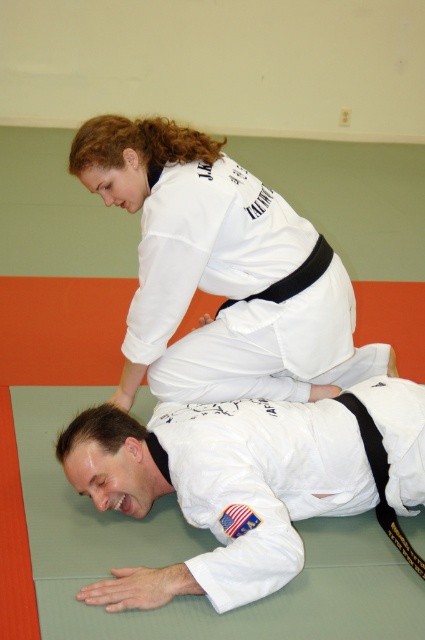
Between white matte kimono at lower center and black matte belt at center, which one appears on the left side from the viewer's perspective?

From the viewer's perspective, white matte kimono at lower center appears more on the left side.

Between point (297, 564) and point (246, 298), which one is positioned in front?

Point (297, 564) is more forward.

Between point (354, 477) and point (277, 291), which one is positioned behind?

Positioned behind is point (277, 291).

At what (x,y) coordinates should I click in order to perform the action: click on white matte kimono at lower center. Please return your answer as a coordinate pair (x, y). This screenshot has height=640, width=425. Looking at the image, I should click on (221, 488).

Is white matte kimono at upper center below white matte kimono at lower center?

No, white matte kimono at upper center is not below white matte kimono at lower center.

Image resolution: width=425 pixels, height=640 pixels. What do you see at coordinates (221, 273) in the screenshot?
I see `white matte kimono at upper center` at bounding box center [221, 273].

What are the coordinates of `white matte kimono at upper center` in the screenshot? It's located at (221, 273).

In the scene shown: Is white matte kimono at upper center taller than black matte belt at center?

Yes, white matte kimono at upper center is taller than black matte belt at center.

The width and height of the screenshot is (425, 640). Describe the element at coordinates (221, 273) in the screenshot. I see `white matte kimono at upper center` at that location.

Locate an element on the screen. The image size is (425, 640). white matte kimono at upper center is located at coordinates (221, 273).